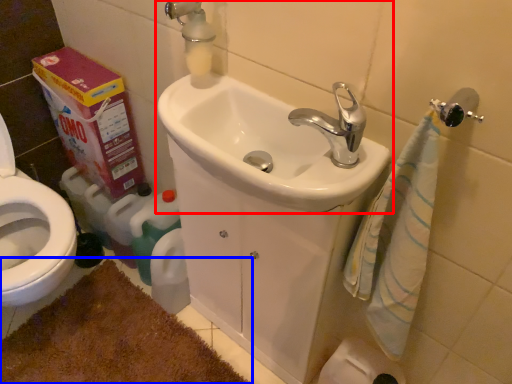
Question: Which point is further to the camera, sink (highlighted by a red box) or bath mat (highlighted by a blue box)?

Choices:
 (A) sink
 (B) bath mat

Answer: (B)